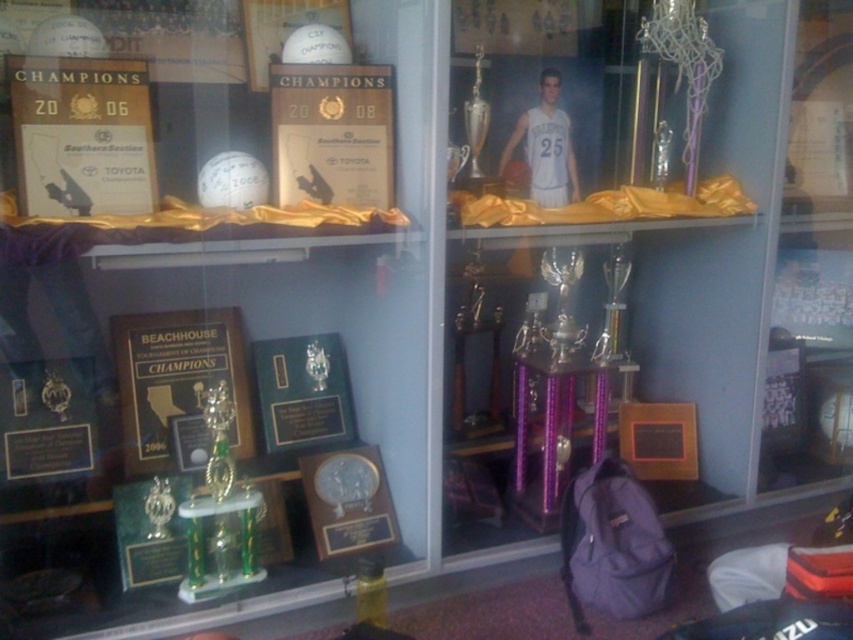
Question: Where is gold plated plaque at center located in relation to gold metallic plaque at lower center in the image?

Choices:
 (A) below
 (B) above

Answer: (A)

Question: Which of the following is the farthest from the observer?

Choices:
 (A) matte gold plaque at center
 (B) metallic silver trophy at center

Answer: (B)

Question: Which of these objects is positioned closest to the gold metallic plaque at lower left?

Choices:
 (A) green glossy plaque at center
 (B) gold plated plaque at center
 (C) matte gold plaque at center
 (D) white glossy plaque at upper center

Answer: (A)

Question: Can you confirm if matte gold plaque at upper left is positioned above gold metallic trophy at center?

Choices:
 (A) yes
 (B) no

Answer: (A)

Question: Which point is farther from the camera taking this photo?

Choices:
 (A) (335, 474)
 (B) (339, 388)
 (C) (614, 278)

Answer: (C)

Question: Is matte gold plaque at upper left closer to the viewer compared to gold metallic plaque at lower center?

Choices:
 (A) no
 (B) yes

Answer: (B)